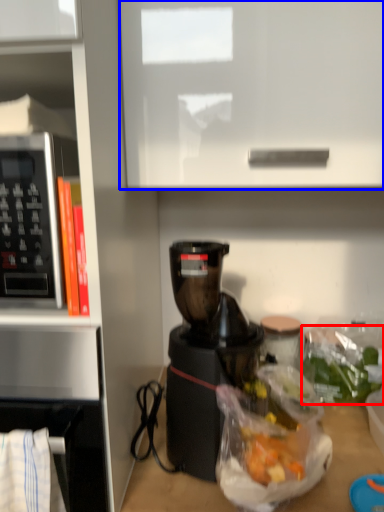
Question: Which object appears farthest to the camera in this image, food (highlighted by a red box) or cabinetry (highlighted by a blue box)?

Choices:
 (A) food
 (B) cabinetry

Answer: (A)